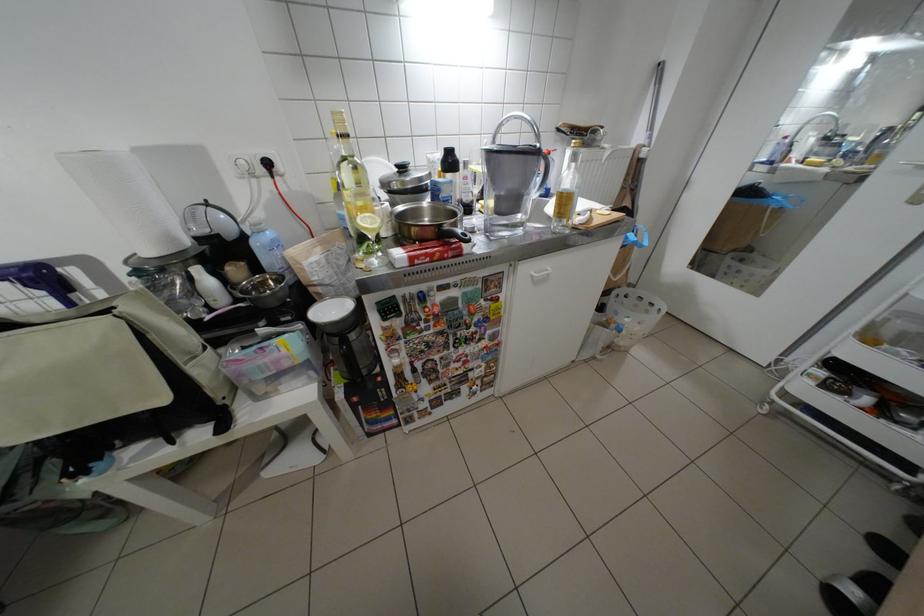
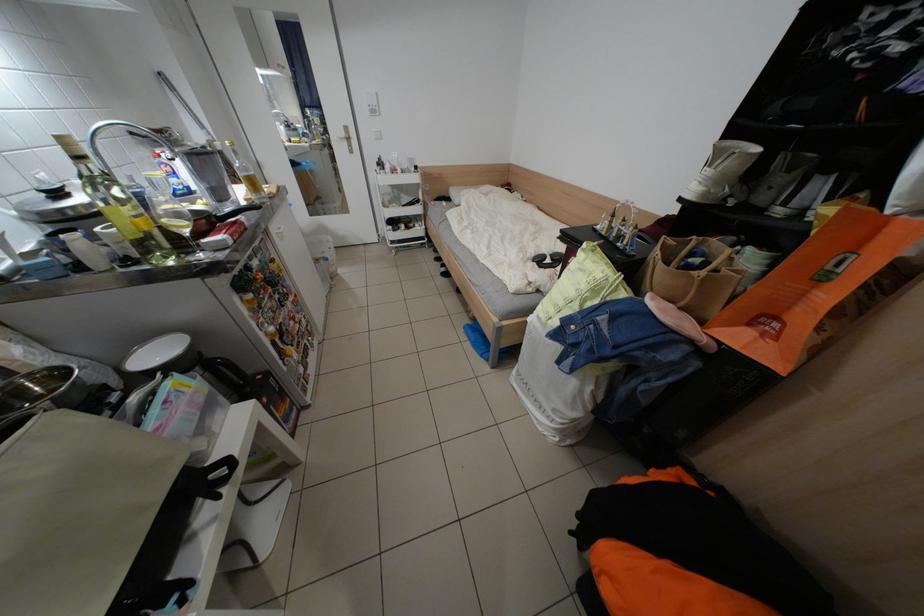
Find the pixel in the second image that matches [655,154] in the first image.

(231, 148)